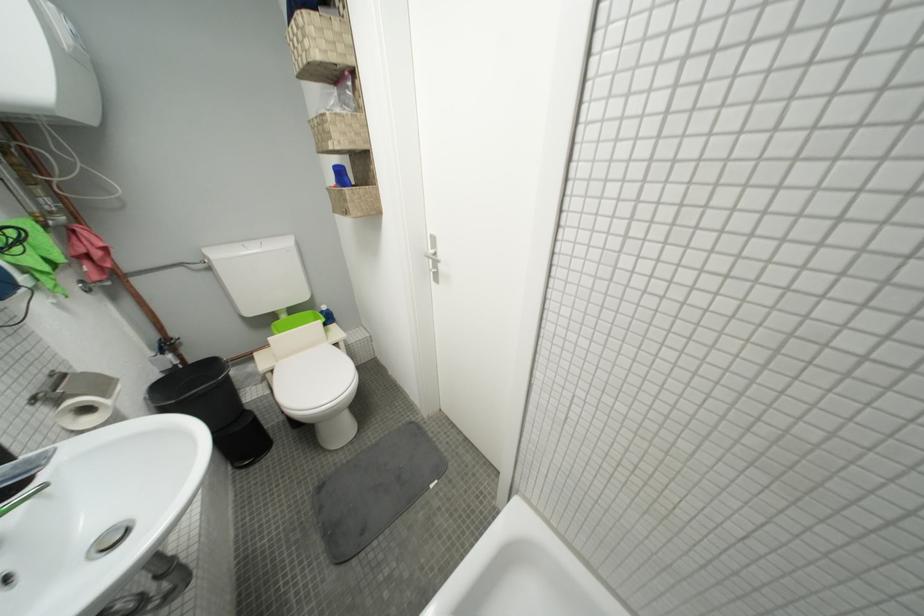
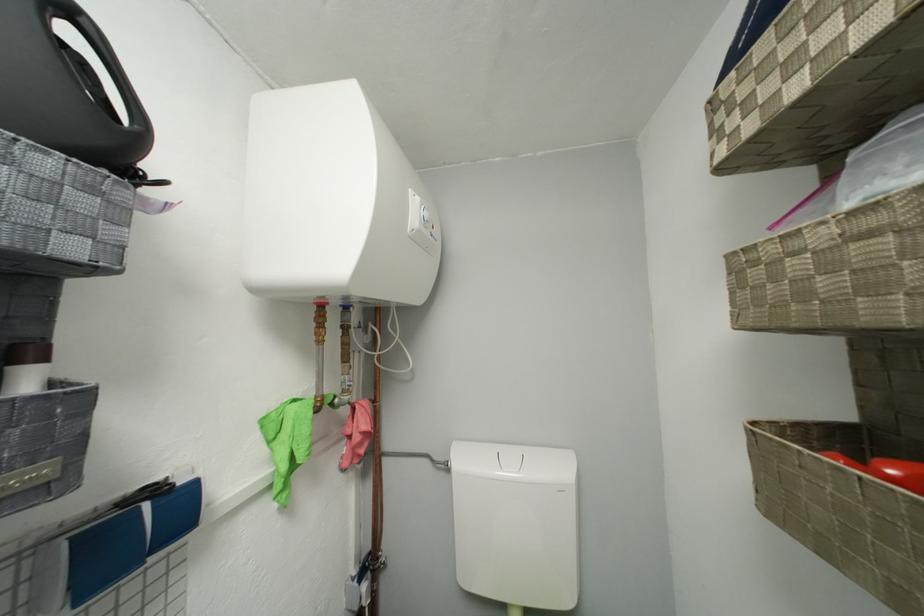
Locate, in the second image, the point that corresponds to pixel 53 270 in the first image.

(293, 469)